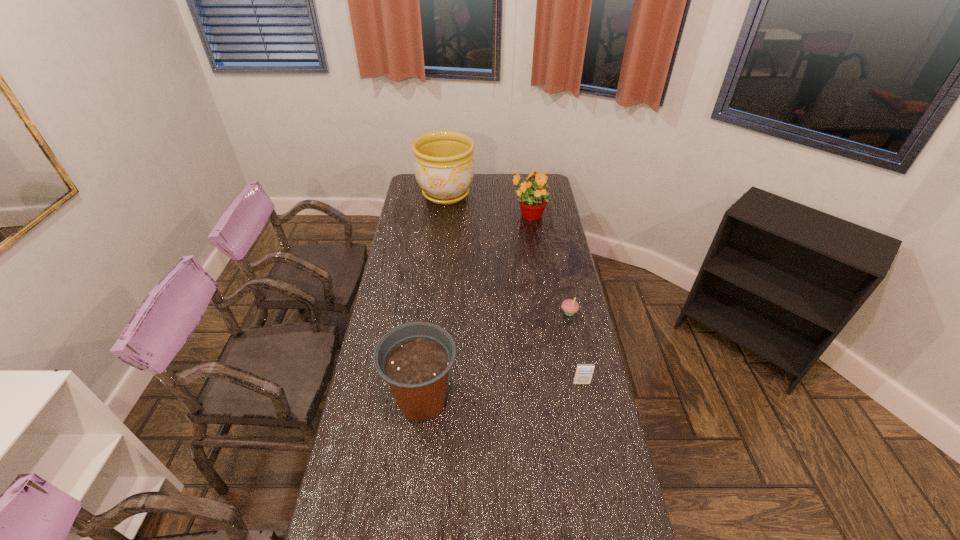
At what (x,y) coordinates should I click in order to perform the action: click on vacant point located between the third farthest object and the iPod. Please return your answer as a coordinate pair (x, y). Looking at the image, I should click on (575, 348).

You are a GUI agent. You are given a task and a screenshot of the screen. Output one action in this format:
    pyautogui.click(x=<x>, y=<y>)
    Task: Click on the vacant region between the cupcake and the nearest flowerpot
    
    Given the screenshot: What is the action you would take?
    pyautogui.click(x=495, y=356)

You are a GUI agent. You are given a task and a screenshot of the screen. Output one action in this format:
    pyautogui.click(x=<x>, y=<y>)
    Task: Click on the empty location between the nearest flowerpot and the iPod
    The height and width of the screenshot is (540, 960).
    Given the screenshot: What is the action you would take?
    pyautogui.click(x=502, y=392)

Locate an element on the screen. object that ranks as the second closest to the nearest flowerpot is located at coordinates pyautogui.click(x=569, y=306).

Identify which object is located as the nearest to the rightmost flowerpot. Please provide its 2D coordinates. Your answer should be formatted as a tuple, i.e. [(x, y)], where the tuple contains the x and y coordinates of a point satisfying the conditions above.

[(444, 168)]

Identify which flowerpot is the third closest to the iPod. Please provide its 2D coordinates. Your answer should be formatted as a tuple, i.e. [(x, y)], where the tuple contains the x and y coordinates of a point satisfying the conditions above.

[(444, 168)]

Identify which flowerpot is located as the nearest to the iPod. Please provide its 2D coordinates. Your answer should be formatted as a tuple, i.e. [(x, y)], where the tuple contains the x and y coordinates of a point satisfying the conditions above.

[(415, 358)]

I want to click on blank space that satisfies the following two spatial constraints: 1. on the back side of the nearest flowerpot; 2. on the left side of the rightmost flowerpot, so click(443, 215).